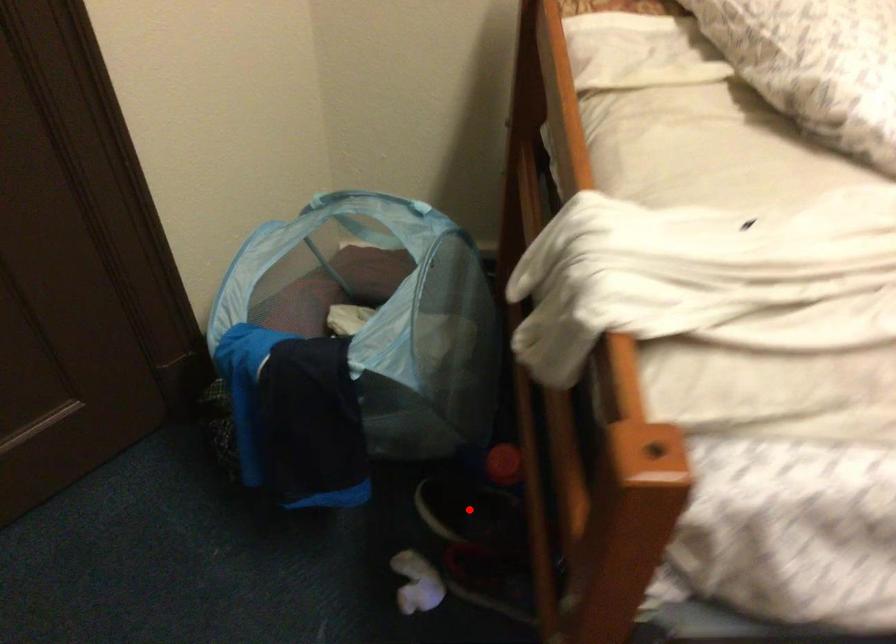
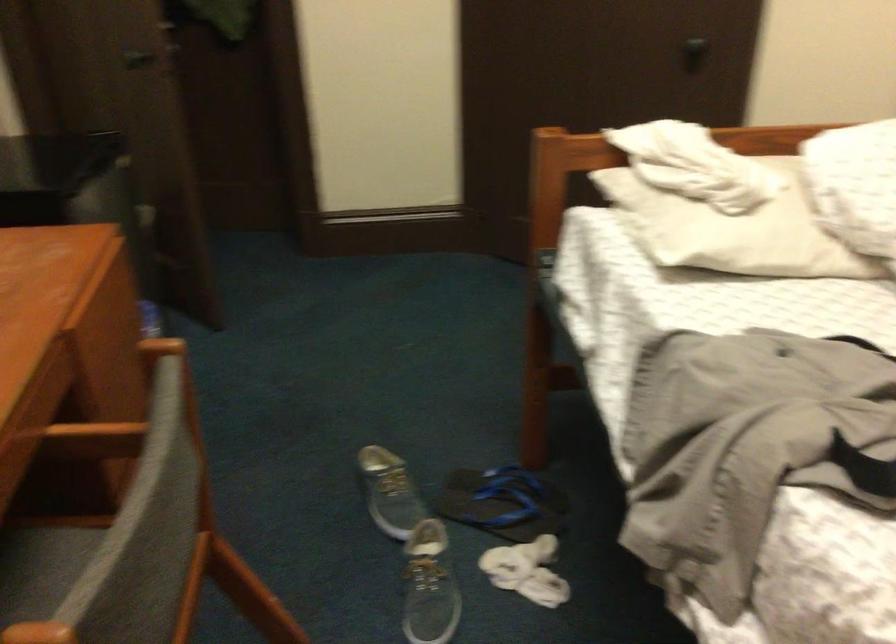
Question: I am providing you with two images of the same scene from different viewpoints. A red point is marked on the first image. Can you still see the location of the red point in image 2?

Choices:
 (A) Yes
 (B) No

Answer: (B)